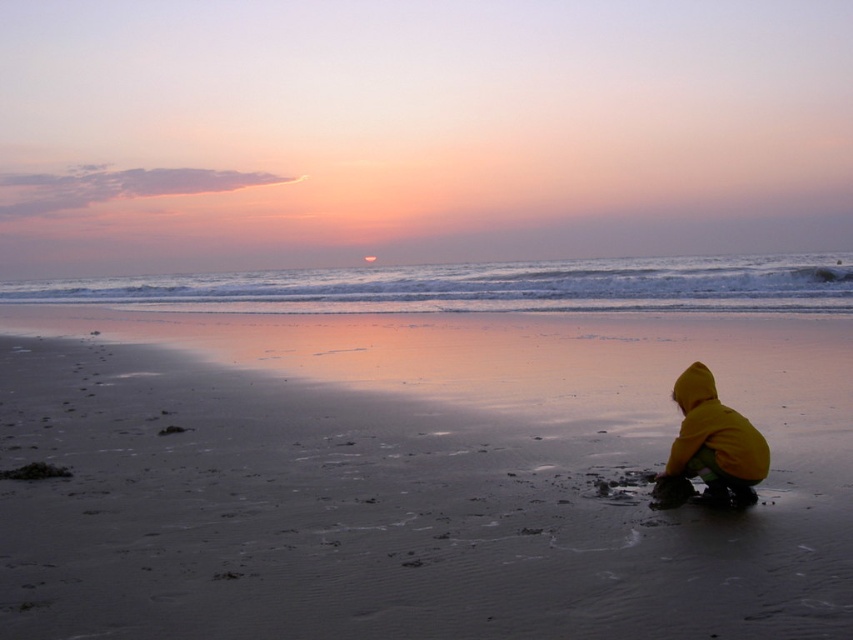
Question: Observing the image, what is the correct spatial positioning of sandy beach at lower right in reference to yellow fabric child at lower right?

Choices:
 (A) left
 (B) right

Answer: (A)

Question: Which point is farther to the camera?

Choices:
 (A) sandy beach at lower right
 (B) yellow fabric child at lower right

Answer: (B)

Question: Among these objects, which one is nearest to the camera?

Choices:
 (A) sandy beach at lower right
 (B) yellow fabric child at lower right

Answer: (A)

Question: Can you confirm if sandy beach at lower right is positioned above yellow fabric child at lower right?

Choices:
 (A) yes
 (B) no

Answer: (A)

Question: Is sandy beach at lower right to the left of yellow fabric child at lower right from the viewer's perspective?

Choices:
 (A) no
 (B) yes

Answer: (B)

Question: Which point is farther to the camera?

Choices:
 (A) sandy beach at lower right
 (B) yellow fabric child at lower right

Answer: (B)